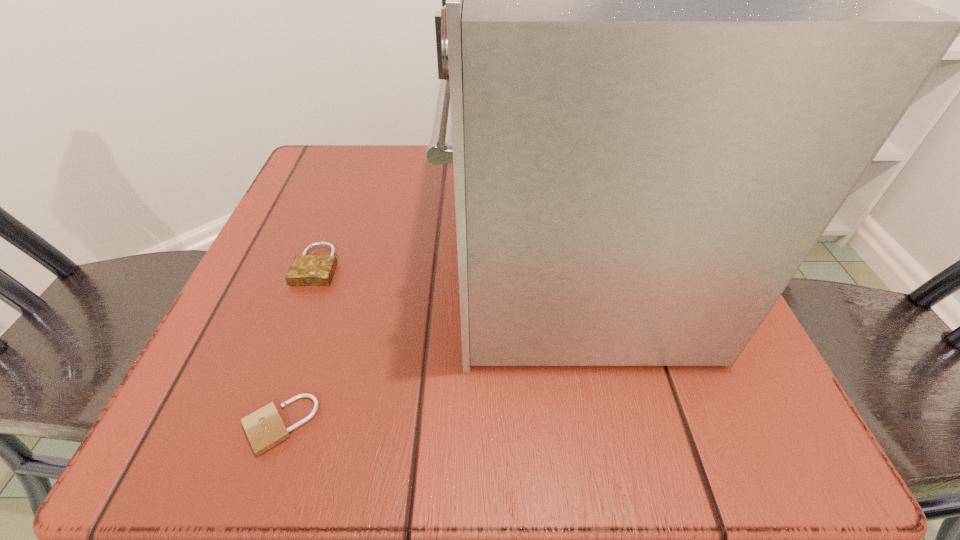
Where is `blank region between the tallest object and the taller padlock`? The height and width of the screenshot is (540, 960). blank region between the tallest object and the taller padlock is located at coordinates (442, 264).

The image size is (960, 540). Identify the location of free spot between the taller padlock and the tallest object. (442, 264).

Where is `free space between the second tallest object and the shortest object`? The image size is (960, 540). free space between the second tallest object and the shortest object is located at coordinates (299, 345).

In order to click on free space between the farther padlock and the nearest object in this screenshot , I will do `click(299, 345)`.

I want to click on empty location between the shortest object and the toaster oven, so click(422, 343).

This screenshot has width=960, height=540. I want to click on vacant region between the toaster oven and the farther padlock, so click(442, 264).

Locate an element on the screen. The width and height of the screenshot is (960, 540). empty location between the shorter padlock and the farther padlock is located at coordinates (299, 345).

I want to click on unoccupied position between the taller padlock and the shorter padlock, so click(x=299, y=345).

Locate an element on the screen. unoccupied area between the rightmost object and the farther padlock is located at coordinates (442, 264).

You are a GUI agent. You are given a task and a screenshot of the screen. Output one action in this format:
    pyautogui.click(x=<x>, y=<y>)
    Task: Click on the free space that is in between the nearest object and the taller padlock
    
    Given the screenshot: What is the action you would take?
    (x=299, y=345)